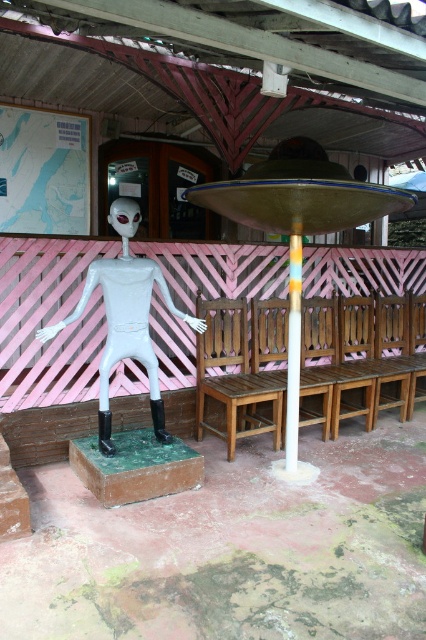
Looking at this image, is white matte alien at left shorter than multicolored striped pole at center?

Incorrect, white matte alien at left's height does not fall short of multicolored striped pole at center's.

This screenshot has width=426, height=640. Describe the element at coordinates (124, 317) in the screenshot. I see `white matte alien at left` at that location.

Consider the image. Measure the distance between white matte alien at left and camera.

11.92 feet

Locate an element on the screen. white matte alien at left is located at coordinates (124, 317).